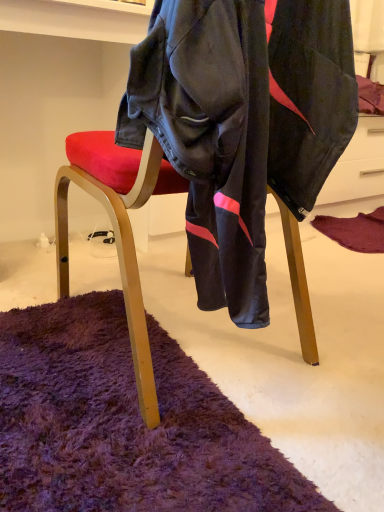
The width and height of the screenshot is (384, 512). What do you see at coordinates (117, 227) in the screenshot?
I see `wooden chair at center` at bounding box center [117, 227].

Find the location of a particular element. This screenshot has height=512, width=384. wooden chair at center is located at coordinates (117, 227).

Image resolution: width=384 pixels, height=512 pixels. I want to click on wooden chair at center, so click(x=117, y=227).